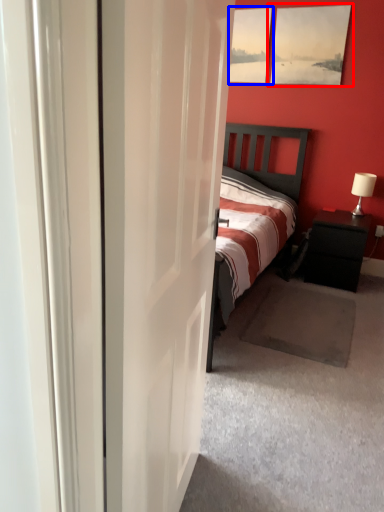
Question: Which object appears farthest to the camera in this image, picture frame (highlighted by a red box) or picture frame (highlighted by a blue box)?

Choices:
 (A) picture frame
 (B) picture frame

Answer: (B)